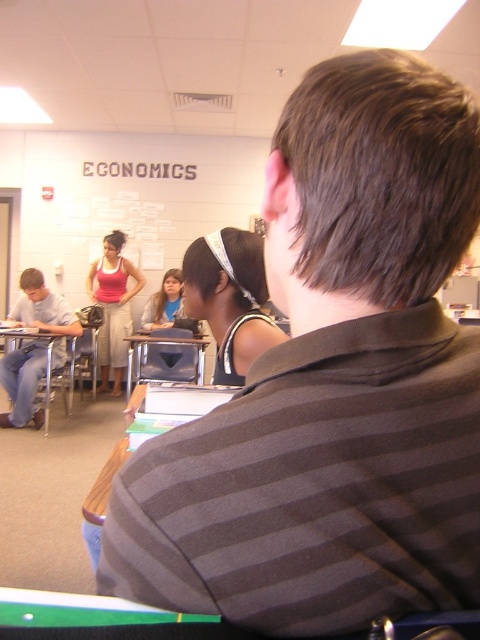
Question: Is white headband at center bigger than metallic silver table at center?

Choices:
 (A) no
 (B) yes

Answer: (A)

Question: Which object appears closest to the camera in this image?

Choices:
 (A) metallic silver table at center
 (B) matte pink tank top at center
 (C) white headband at center

Answer: (C)

Question: Which object appears farthest from the camera in this image?

Choices:
 (A) metallic silver table at center
 (B) matte gray shirt at left

Answer: (B)

Question: Which is farther from the metallic silver table at center?

Choices:
 (A) matte pink tank top at center
 (B) matte gray shirt at left
 (C) white headband at center

Answer: (C)

Question: Where is white headband at center located in relation to green felt table at lower left in the image?

Choices:
 (A) left
 (B) right

Answer: (B)

Question: Does matte gray shirt at left appear on the right side of metallic silver table at center?

Choices:
 (A) no
 (B) yes

Answer: (A)